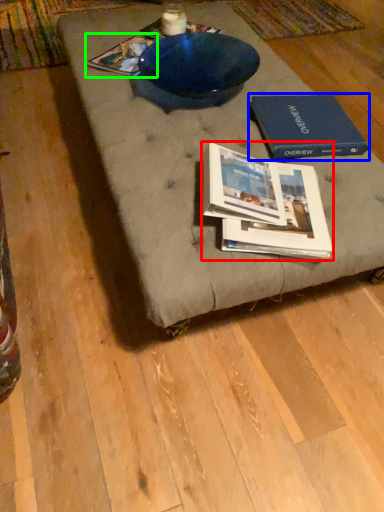
Question: Which object is the farthest from book (highlighted by a red box)? Choose among these: paperback book (highlighted by a blue box) or book (highlighted by a green box).

Choices:
 (A) paperback book
 (B) book

Answer: (B)